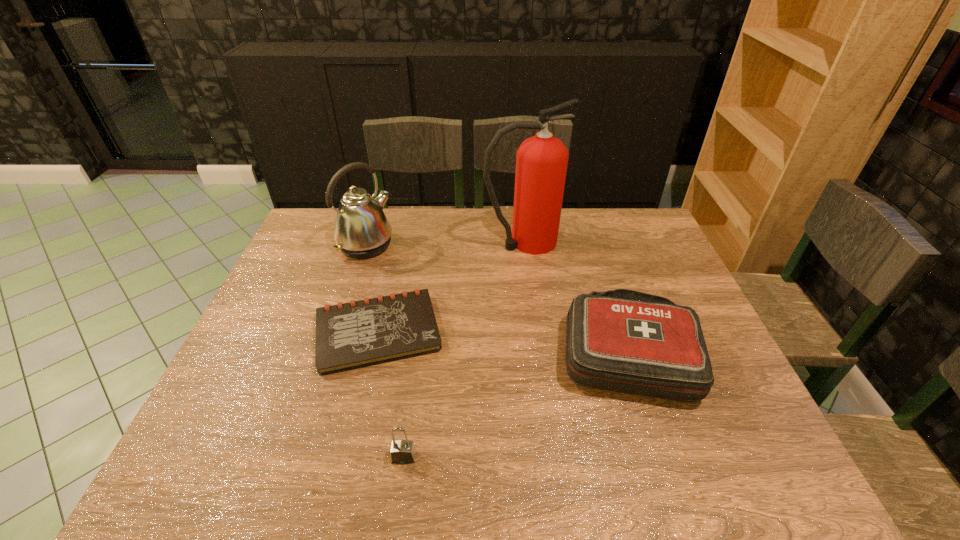
I want to click on the tallest object, so click(541, 161).

You are a GUI agent. You are given a task and a screenshot of the screen. Output one action in this format:
    pyautogui.click(x=<x>, y=<y>)
    Task: Click on the fourth shortest object
    The width and height of the screenshot is (960, 540).
    Given the screenshot: What is the action you would take?
    pyautogui.click(x=362, y=230)

Where is `the first-aid kit`? This screenshot has height=540, width=960. the first-aid kit is located at coordinates (621, 340).

Identify the location of the nearest object. The height and width of the screenshot is (540, 960). (402, 452).

The image size is (960, 540). Identify the location of the shortest object. (351, 335).

Find the location of a particular element. vacant position located 0.230m on the handle side of the fire extinguisher is located at coordinates (631, 242).

Locate an element on the screen. This screenshot has width=960, height=540. free region located on the left of the second tallest object is located at coordinates (301, 245).

Locate an element on the screen. This screenshot has height=540, width=960. free space located 0.240m on the left of the first-aid kit is located at coordinates (466, 352).

Where is `vacant space positioned on the right of the notebook`? The width and height of the screenshot is (960, 540). vacant space positioned on the right of the notebook is located at coordinates (579, 332).

This screenshot has width=960, height=540. Identify the location of fire extinguisher that is at the far edge. (541, 161).